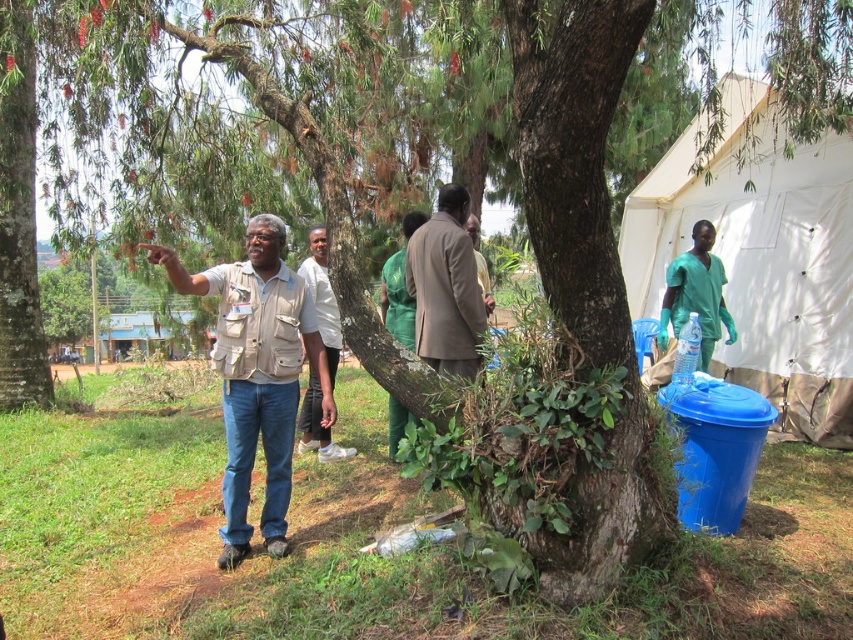
Question: Can you confirm if white fabric tent at upper right is positioned to the right of beige fabric shirt at center?

Choices:
 (A) yes
 (B) no

Answer: (A)

Question: Considering the real-world distances, which object is closest to the brown fabric jacket at center?

Choices:
 (A) beige fabric shirt at center
 (B) green scrubs at right

Answer: (A)

Question: Does brown fabric jacket at center have a larger size compared to green scrubs at right?

Choices:
 (A) no
 (B) yes

Answer: (A)

Question: Which of the following is the closest to the observer?

Choices:
 (A) click(x=845, y=332)
 (B) click(x=476, y=358)
 (C) click(x=672, y=266)

Answer: (B)

Question: Is white fabric tent at upper right wider than white matte shirt at center?

Choices:
 (A) yes
 (B) no

Answer: (A)

Question: Based on their relative distances, which object is farther from the white matte shirt at center?

Choices:
 (A) brown fabric jacket at center
 (B) white fabric tent at upper right
 (C) beige fabric shirt at center
 (D) green scrubs at right

Answer: (B)